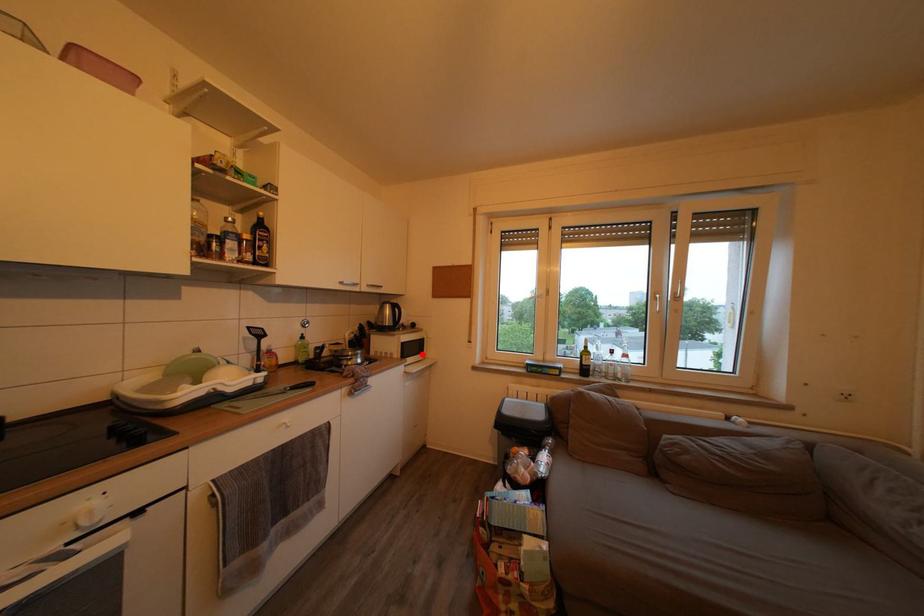
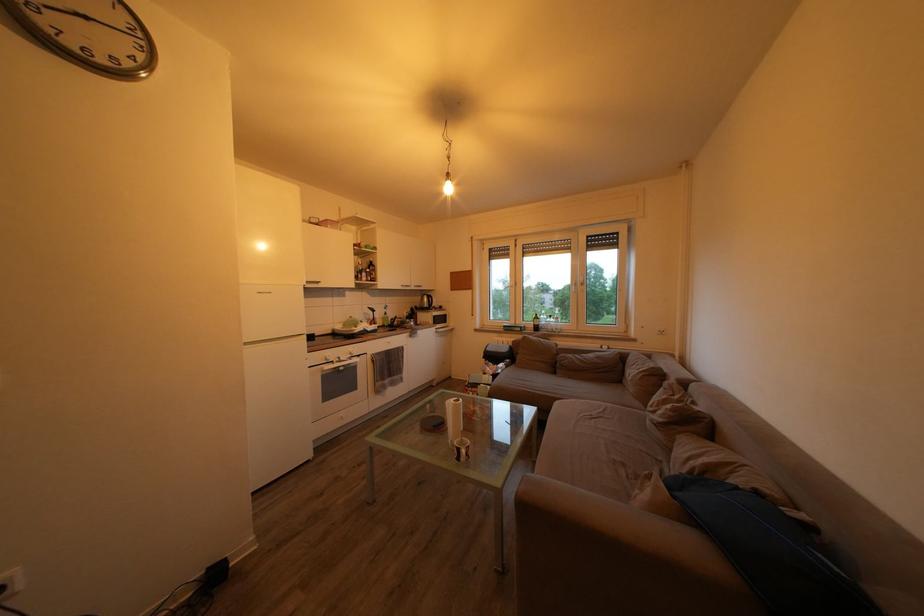
In the second image, find the point that corresponds to the highlighted location in the first image.

(448, 326)